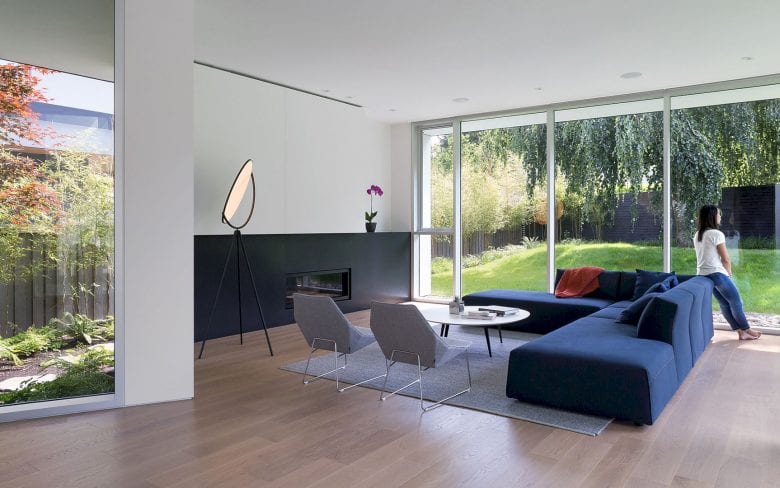
The width and height of the screenshot is (780, 488). I want to click on floor to ceiling window left of room, so click(55, 251).